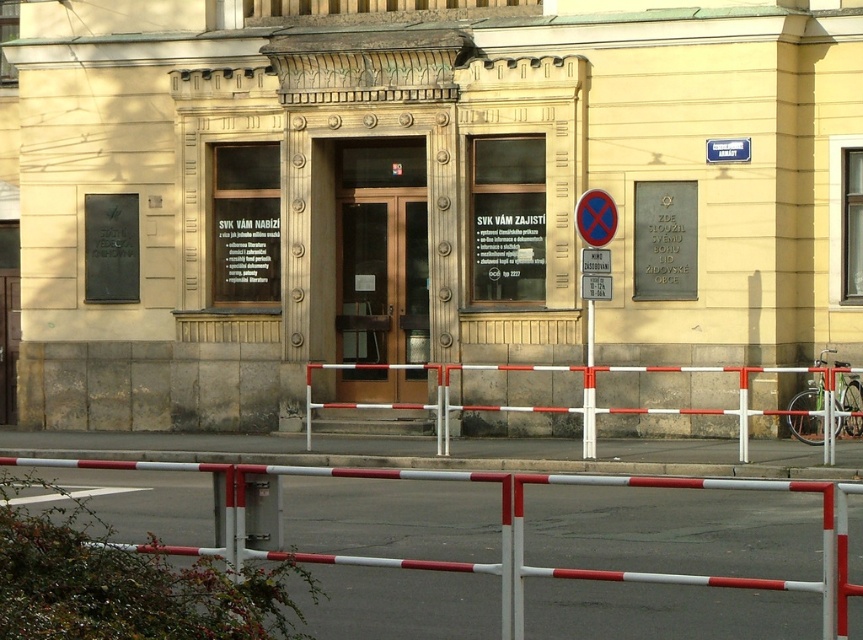
In the scene shown: Which of these two, bronze glass door at center or white metal barricade at center, stands taller?

Standing taller between the two is bronze glass door at center.

Does bronze glass door at center come in front of white metal barricade at center?

No.

Where is `bronze glass door at center`? Image resolution: width=863 pixels, height=640 pixels. bronze glass door at center is located at coordinates (382, 276).

Is bronze glass door at center shorter than white plastic pole at center?

Incorrect, bronze glass door at center's height does not fall short of white plastic pole at center's.

Is point (376, 284) farther from camera compared to point (591, 406)?

That is True.

The width and height of the screenshot is (863, 640). Describe the element at coordinates (382, 276) in the screenshot. I see `bronze glass door at center` at that location.

The height and width of the screenshot is (640, 863). Identify the location of bronze glass door at center. (382, 276).

Which is behind, point (488, 406) or point (589, 301)?

The point (589, 301) is behind.

What do you see at coordinates (594, 400) in the screenshot? I see `white metal barricade at center` at bounding box center [594, 400].

This screenshot has height=640, width=863. I want to click on white metal barricade at center, so click(x=594, y=400).